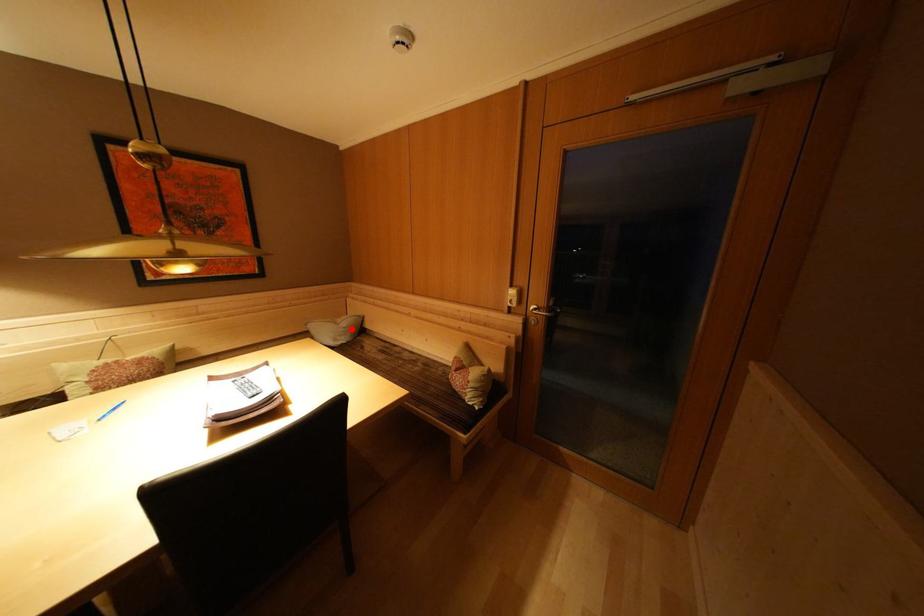
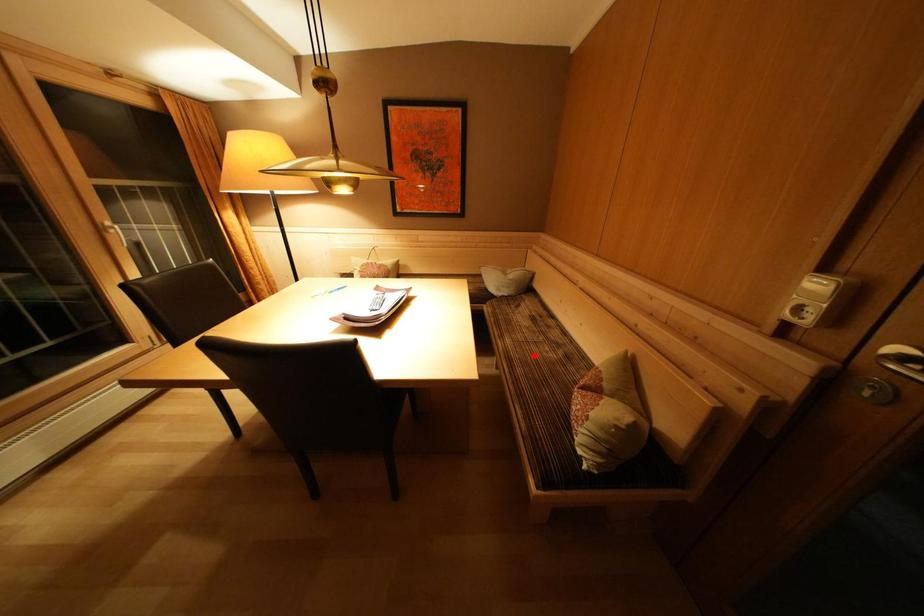
I am providing you with two images of the same scene from different viewpoints. A red point is marked on the first image and another point is marked on the second image. Is the marked point in image1 the same physical position as the marked point in image2?

No